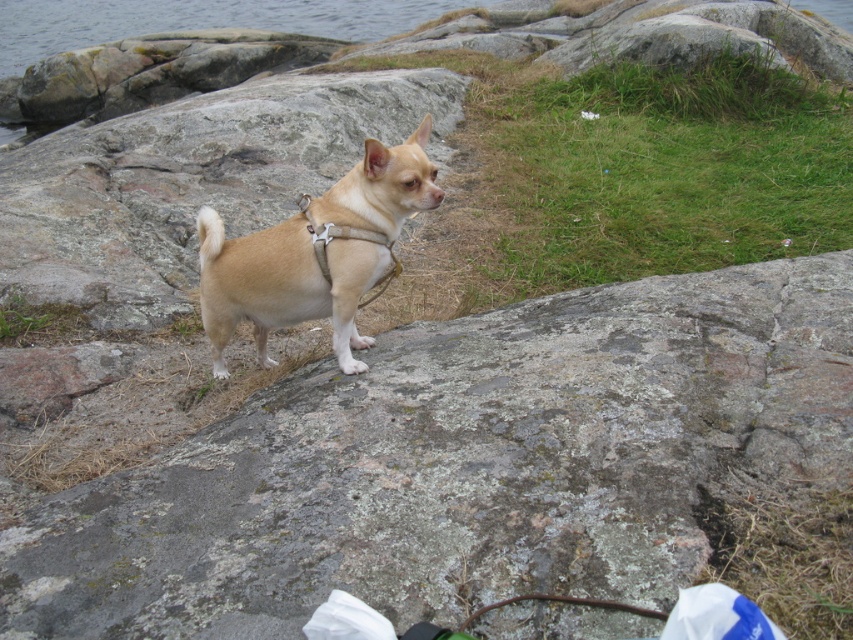
Question: Does smooth gray rock at center appear over tan matte harness at center?

Choices:
 (A) no
 (B) yes

Answer: (A)

Question: Which point is closer to the camera taking this photo?

Choices:
 (A) (291, 301)
 (B) (433, 508)

Answer: (B)

Question: Is smooth gray rock at center positioned in front of tan matte harness at center?

Choices:
 (A) no
 (B) yes

Answer: (B)

Question: Which object appears farthest from the camera in this image?

Choices:
 (A) tan matte harness at center
 (B) smooth gray rock at center

Answer: (A)

Question: Is smooth gray rock at center above tan matte harness at center?

Choices:
 (A) no
 (B) yes

Answer: (A)